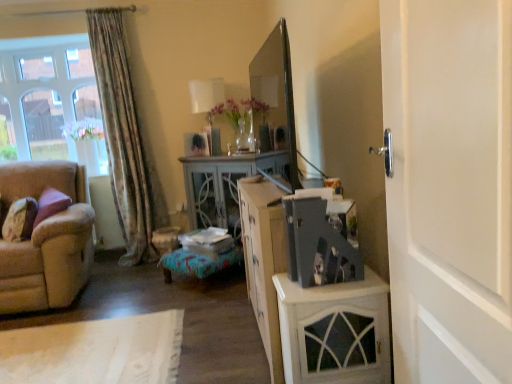
Question: Does clear glass window at upper left have a greater width compared to white painted wood cabinet at right?

Choices:
 (A) yes
 (B) no

Answer: (B)

Question: Are clear glass window at upper left and white painted wood cabinet at right located far from each other?

Choices:
 (A) yes
 (B) no

Answer: (A)

Question: Can you confirm if clear glass window at upper left is smaller than white painted wood cabinet at right?

Choices:
 (A) no
 (B) yes

Answer: (A)

Question: From a real-world perspective, is clear glass window at upper left beneath white painted wood cabinet at right?

Choices:
 (A) no
 (B) yes

Answer: (A)

Question: Is clear glass window at upper left shorter than white painted wood cabinet at right?

Choices:
 (A) yes
 (B) no

Answer: (B)

Question: From a real-world perspective, is clear glass window at upper left on top of white painted wood cabinet at right?

Choices:
 (A) yes
 (B) no

Answer: (A)

Question: Is velvet purple pillow at left turned away from matte gray photo album at center?

Choices:
 (A) no
 (B) yes

Answer: (A)

Question: Is velvet purple pillow at left at the right side of matte gray photo album at center?

Choices:
 (A) yes
 (B) no

Answer: (B)

Question: Does velvet purple pillow at left touch matte gray photo album at center?

Choices:
 (A) no
 (B) yes

Answer: (A)

Question: From a real-world perspective, is velvet purple pillow at left physically below matte gray photo album at center?

Choices:
 (A) yes
 (B) no

Answer: (A)

Question: Could you tell me if velvet purple pillow at left is turned towards matte gray photo album at center?

Choices:
 (A) yes
 (B) no

Answer: (B)

Question: From the image's perspective, is velvet purple pillow at left located beneath matte gray photo album at center?

Choices:
 (A) yes
 (B) no

Answer: (A)

Question: Does white painted wood door at right appear on the left side of clear glass window at upper left?

Choices:
 (A) yes
 (B) no

Answer: (B)